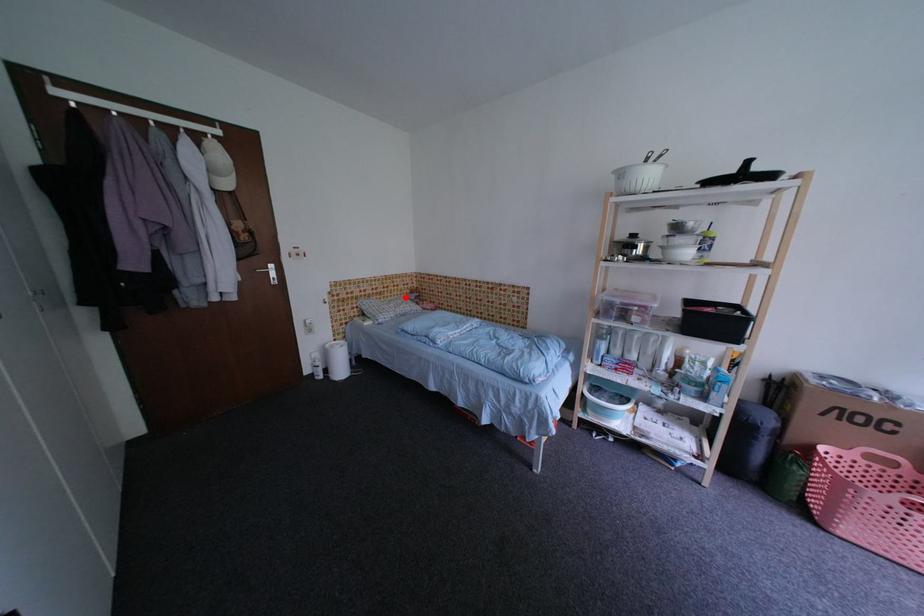
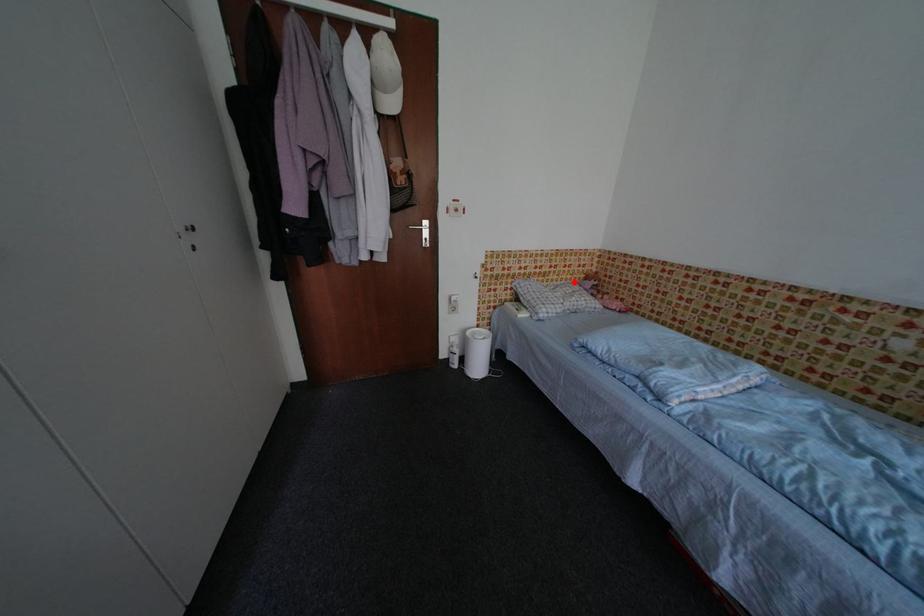
I am providing you with two images of the same scene from different viewpoints. A red point is marked on the first image and another point is marked on the second image. Do the highlighted points in image1 and image2 indicate the same real-world spot?

Yes